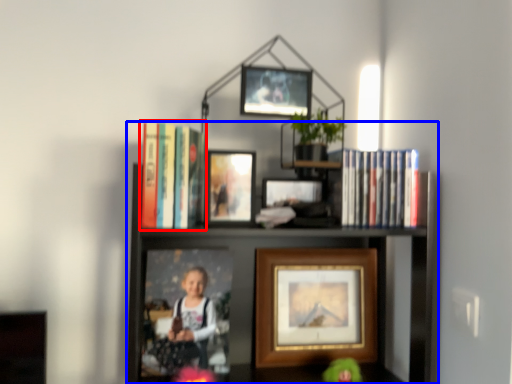
Question: Among these objects, which one is farthest to the camera, book (highlighted by a red box) or shelf (highlighted by a blue box)?

Choices:
 (A) book
 (B) shelf

Answer: (A)